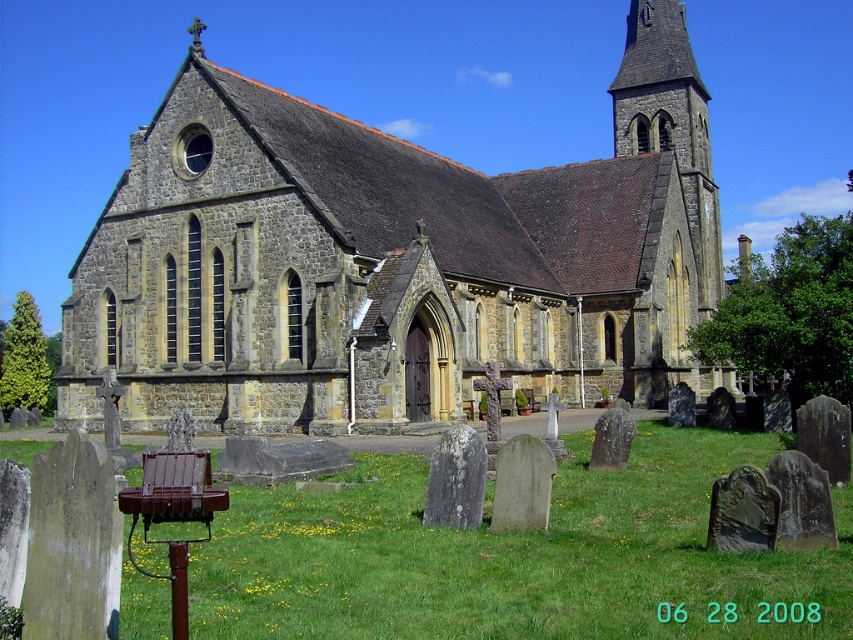
Which is behind, point (265, 252) or point (432, 516)?

The point (265, 252) is behind.

Which of these two, stone church at center or gray stone gravestone at center, stands taller?

stone church at center is taller.

This screenshot has height=640, width=853. In order to click on stone church at center in this screenshot , I will do `click(392, 260)`.

Identify the location of stone church at center. (392, 260).

Does point (216, 113) come in front of point (537, 522)?

No.

From the picture: Is stone church at center in front of smooth gray stone gravestone at center?

No.

The height and width of the screenshot is (640, 853). Find the location of `stone church at center`. stone church at center is located at coordinates (392, 260).

Can you confirm if gray stone gravestone at center is positioned to the right of smooth gray stone gravestone at center?

Incorrect, gray stone gravestone at center is not on the right side of smooth gray stone gravestone at center.

This screenshot has height=640, width=853. I want to click on gray stone gravestone at center, so click(x=456, y=480).